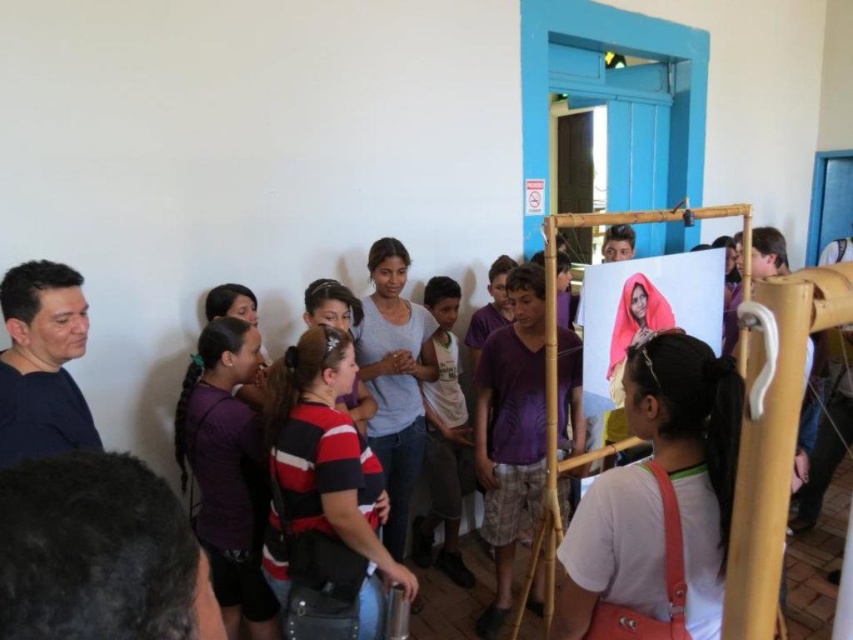
Question: Can you confirm if white fabric at center is positioned below white cotton shirt at center?

Choices:
 (A) no
 (B) yes

Answer: (A)

Question: Which point is farther to the camera?

Choices:
 (A) pos(461,426)
 (B) pos(315,394)
 (C) pos(598,493)
 (D) pos(224,424)

Answer: (A)

Question: Is white fabric at center smaller than white cotton shirt at center?

Choices:
 (A) no
 (B) yes

Answer: (B)

Question: Where is white fabric at center located in relation to striped fabric shirt at center in the image?

Choices:
 (A) left
 (B) right

Answer: (B)

Question: Which point is closer to the camera?

Choices:
 (A) striped fabric shirt at center
 (B) purple fabric shirt at lower left

Answer: (A)

Question: Which of the following is the closest to the observer?

Choices:
 (A) click(x=335, y=413)
 (B) click(x=456, y=554)
 (C) click(x=697, y=634)
 (D) click(x=231, y=449)

Answer: (C)